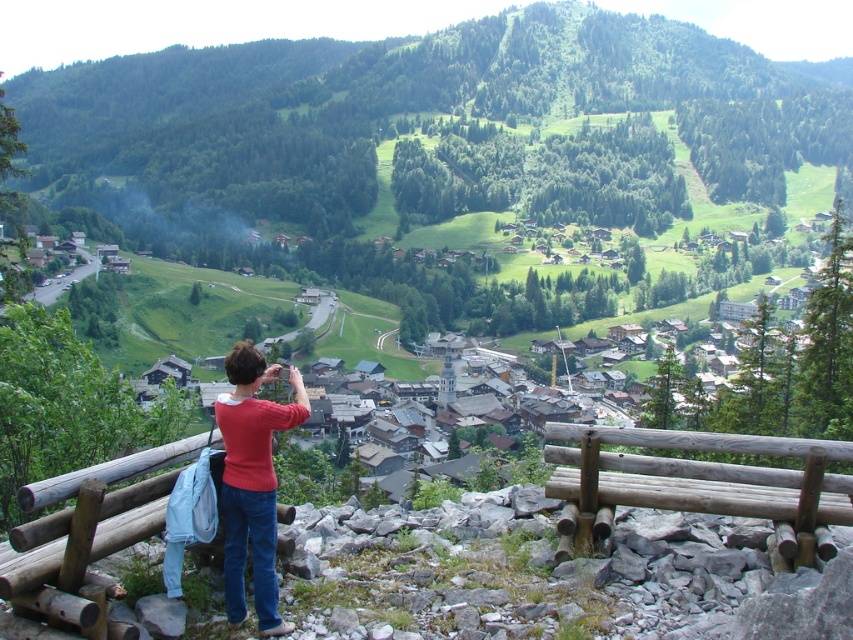
You are standing on a mountain overlook and want to sit down to rest. There is a brown wooden bench at lower center and a matte red sweater at center. Which object is closer to your right side if you are facing the mountain view?

The brown wooden bench at lower center is to the right of matte red sweater at center, so if you are facing the mountain view, the brown wooden bench at lower center would be closer to your right side.

You are planning to sit on the brown wooden bench at lower center while holding the matte red sweater at center. Can the bench accommodate both your body and the sweater without overlapping?

The brown wooden bench at lower center is wider than the matte red sweater at center, so yes, the bench can accommodate both your body and the sweater without overlapping.